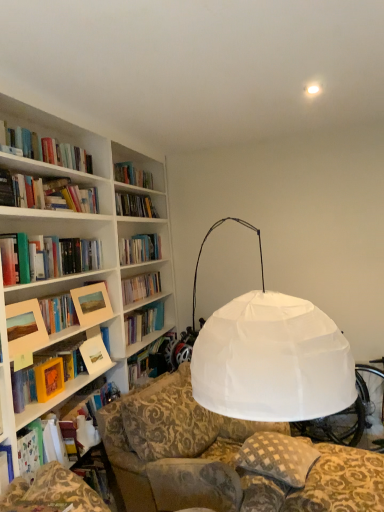
Question: Looking at the image, does matte wooden picture frame at upper left, positioned as the 2th picture frame in left-to-right order, seem bigger or smaller compared to yellow matte paper at left, arranged as the 1th paperback book when viewed from the front?

Choices:
 (A) small
 (B) big

Answer: (B)

Question: Considering the positions of matte wooden picture frame at upper left, the 2th picture frame viewed from the front, and yellow matte paper at left, the 2th paperback book when ordered from back to front, in the image, is matte wooden picture frame at upper left, the 2th picture frame viewed from the front, wider or thinner than yellow matte paper at left, the 2th paperback book when ordered from back to front,?

Choices:
 (A) wide
 (B) thin

Answer: (A)

Question: Which is nearer to the checkered fabric pillow at lower center?

Choices:
 (A) yellow matte paper at left, the 2th paperback book when ordered from back to front
 (B) matte wooden picture frame at upper left, placed as the 1th picture frame when sorted from right to left
 (C) matte wooden picture frame at left, arranged as the 1th picture frame when viewed from the front
 (D) matte white book at left, which ranks as the 2th paperback book in left-to-right order

Answer: (D)

Question: Which is nearer to the matte wooden picture frame at left, the second picture frame from the right?

Choices:
 (A) matte wooden picture frame at upper left, the 2th picture frame viewed from the front
 (B) matte white book at left, which is counted as the 1th paperback book, starting from the right
 (C) yellow matte paper at left, arranged as the 1th paperback book when viewed from the front
 (D) checkered fabric pillow at lower center

Answer: (C)